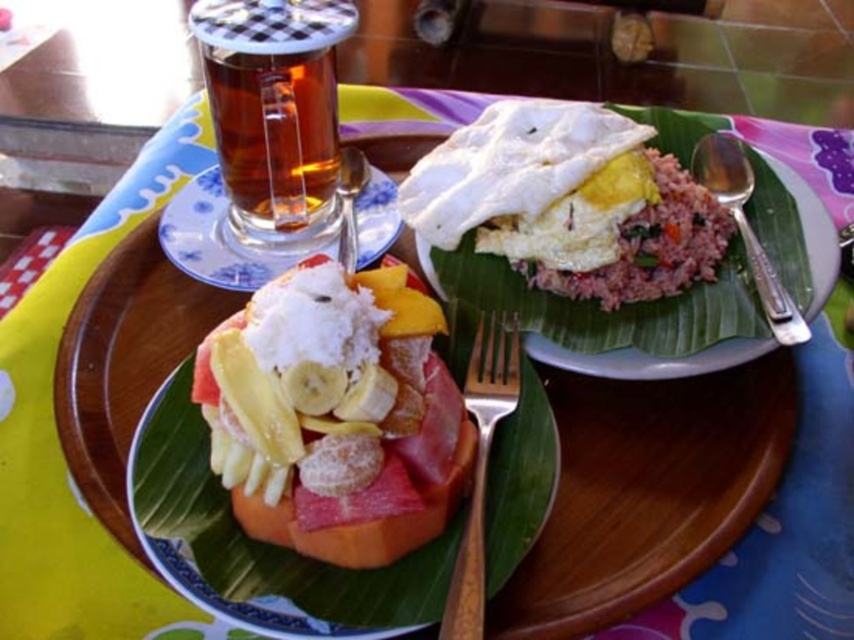
You are a customer at the outdoor table and want to reach both the point at coordinates point (427, 416) and the point at coordinates point (489, 141). Which point is closer to you?

Point (427, 416) is in front of point (489, 141), so it is closer to you.

You are holding a small toy that is 10 inches long. You want to place it on the wooden tray in the image. Can you fit the entire toy on the tray without it hanging off the edge? Please consider the distance of point (361, 602) from the camera.

The distance of point (361, 602) from the camera is 9.80 inches. Since the toy is 10 inches long, it would be slightly too long to fit on the tray as it would extend beyond the edge by approximately 0.2 inches.

You are a person with a 20 cm long arm. You want to pick up the gold metallic fork at center from where you are standing. Can you reach it?

The gold metallic fork at center is 22.70 centimeters away from you, so yes, you can reach it with your 20 cm long arm since your arm is shorter than the distance.